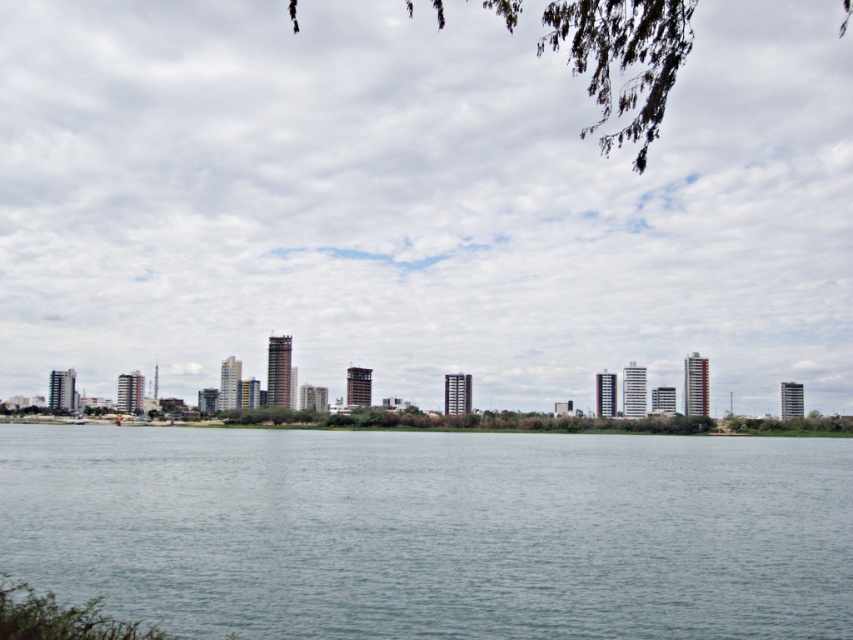
Question: Which of the following is the closest to the observer?

Choices:
 (A) transparent glass skyline at center
 (B) gray water at center

Answer: (B)

Question: Does transparent glass skyline at center have a larger size compared to gray water at center?

Choices:
 (A) yes
 (B) no

Answer: (A)

Question: Which object is farther from the camera taking this photo?

Choices:
 (A) transparent glass skyline at center
 (B) gray water at center

Answer: (A)

Question: Can you confirm if transparent glass skyline at center is thinner than gray water at center?

Choices:
 (A) no
 (B) yes

Answer: (A)

Question: Can you confirm if transparent glass skyline at center is wider than gray water at center?

Choices:
 (A) yes
 (B) no

Answer: (A)